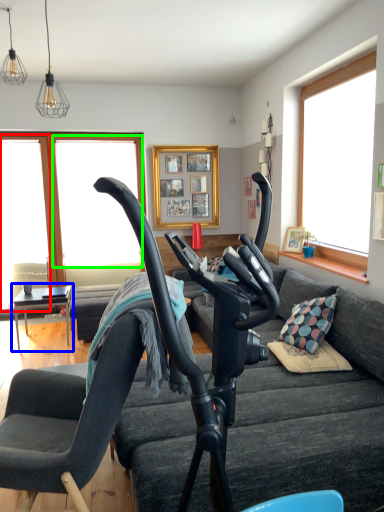
Question: Estimate the real-world distances between objects in this image. Which object is closer to window screen (highlighted by a red box), table (highlighted by a blue box) or window screen (highlighted by a green box)?

Choices:
 (A) table
 (B) window screen

Answer: (B)